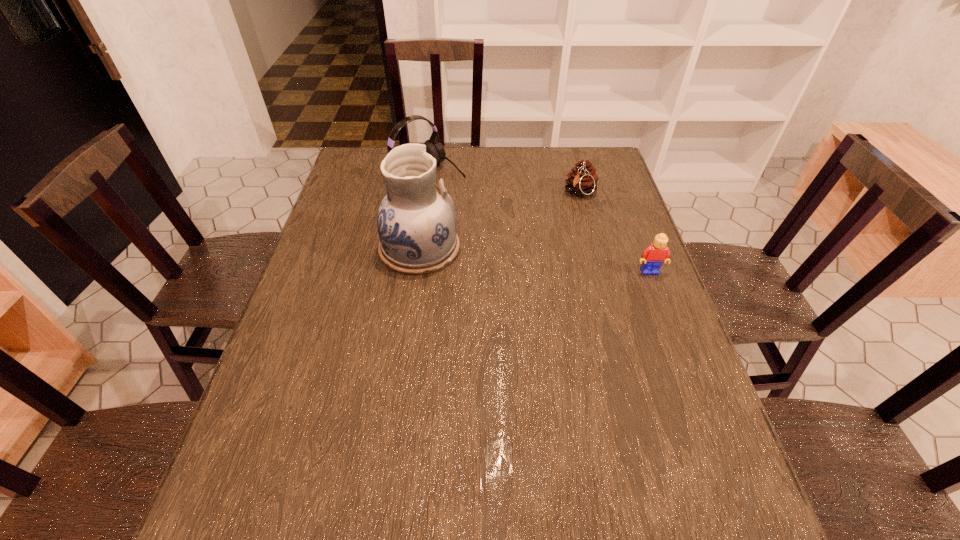
What are the coordinates of `unoccupied area between the pottery and the third object from left to right` in the screenshot? It's located at (500, 221).

At what (x,y) coordinates should I click in order to perform the action: click on vacant area that lies between the third shortest object and the pinecone. Please return your answer as a coordinate pair (x, y). Image resolution: width=960 pixels, height=540 pixels. Looking at the image, I should click on (504, 183).

Find the location of a particular element. This screenshot has height=540, width=960. free space between the rightmost object and the pinecone is located at coordinates (614, 232).

Locate an element on the screen. This screenshot has width=960, height=540. empty location between the third object from left to right and the Lego is located at coordinates (614, 232).

Identify the location of free space between the pottery and the third object from left to right. (500, 221).

The image size is (960, 540). I want to click on free space that is in between the Lego and the pottery, so (x=535, y=260).

Identify which object is the third nearest to the rightmost object. Please provide its 2D coordinates. Your answer should be formatted as a tuple, i.e. [(x, y)], where the tuple contains the x and y coordinates of a point satisfying the conditions above.

[(433, 147)]

Identify which object is the third closest to the headset. Please provide its 2D coordinates. Your answer should be formatted as a tuple, i.e. [(x, y)], where the tuple contains the x and y coordinates of a point satisfying the conditions above.

[(653, 257)]

In order to click on free location that satisfies the following two spatial constraints: 1. on the front side of the headset; 2. on the right side of the third object from left to right in this screenshot , I will do `click(424, 193)`.